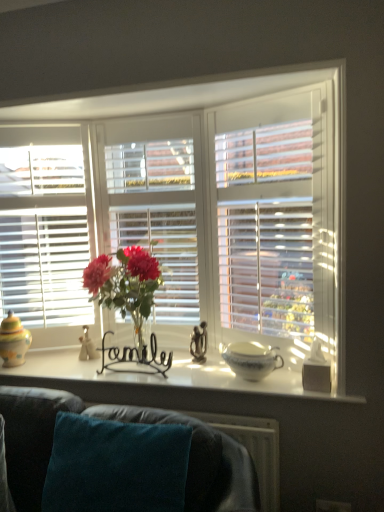
At what (x,y) coordinates should I click in order to perform the action: click on vacant space in white ceramic bowl at center (from a real-world perspective). Please return your answer as a coordinate pair (x, y). Looking at the image, I should click on (259, 378).